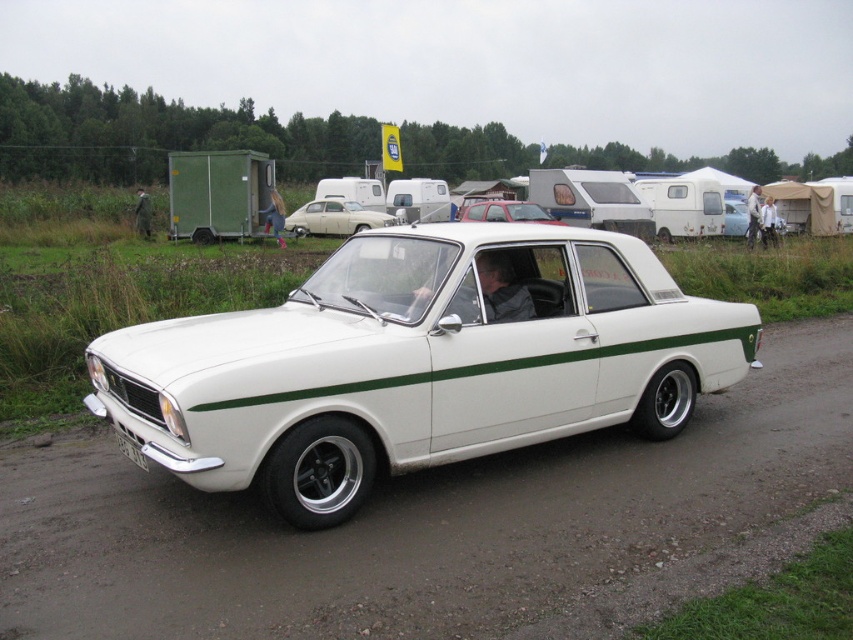
Which is more to the right, matte white car at center or matte red car at center?

matte red car at center

Can you confirm if matte white car at center is taller than matte red car at center?

Yes.

Does point (389, 221) come farther from viewer compared to point (543, 216)?

Yes, it is.

The width and height of the screenshot is (853, 640). What are the coordinates of `matte white car at center` in the screenshot? It's located at pyautogui.click(x=335, y=218).

Where is `white metallic car at center`? The image size is (853, 640). white metallic car at center is located at coordinates (419, 362).

Is white metallic car at center bigger than matte red car at center?

No.

Between point (422, 237) and point (525, 209), which one is positioned behind?

The point (525, 209) is more distant.

In order to click on white metallic car at center in this screenshot , I will do `click(419, 362)`.

Does white smooth dirt track at center appear under white metallic car at center?

Indeed, white smooth dirt track at center is positioned under white metallic car at center.

Between white smooth dirt track at center and white metallic car at center, which one is positioned higher?

white metallic car at center is above.

Is point (550, 596) farther from viewer compared to point (491, 429)?

No, (550, 596) is closer to viewer.

Find the location of `white smooth dirt track at center`. white smooth dirt track at center is located at coordinates (428, 525).